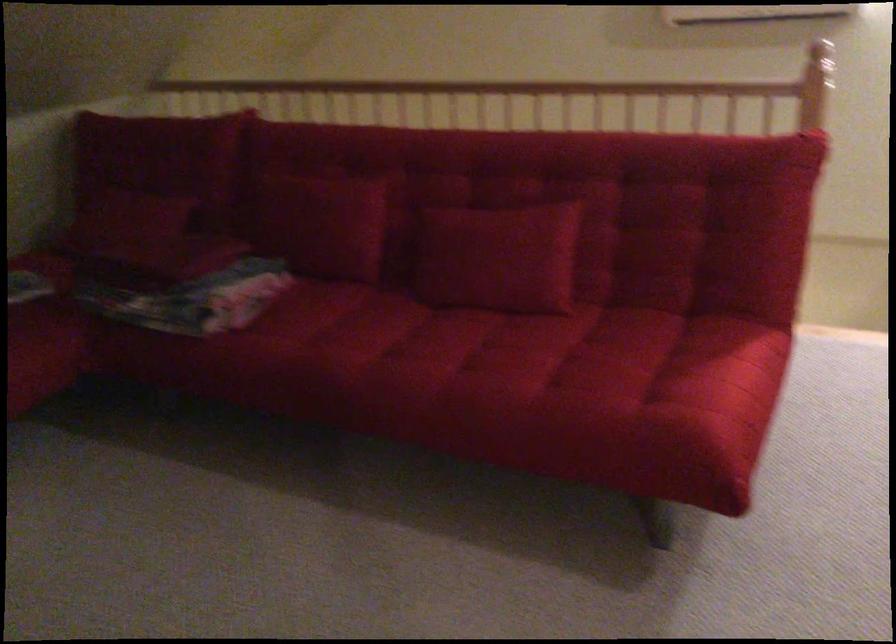
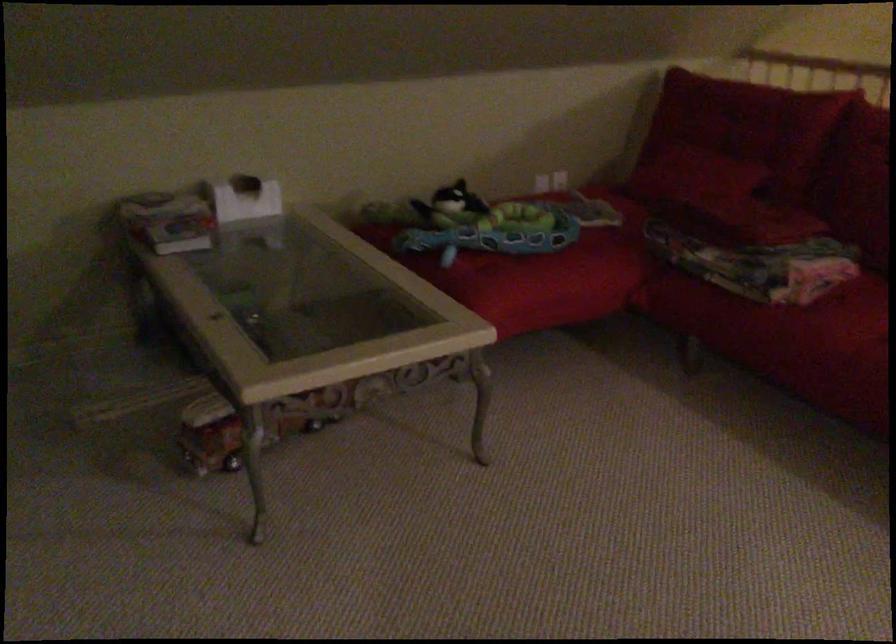
The point at (268, 334) is marked in the first image. Where is the corresponding point in the second image?

(843, 317)